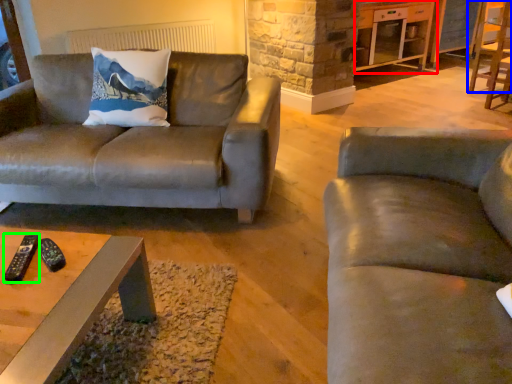
Question: Which object is the closest to the entertainment center (highlighted by a red box)? Choose among these: chair (highlighted by a blue box) or remote (highlighted by a green box).

Choices:
 (A) chair
 (B) remote

Answer: (A)